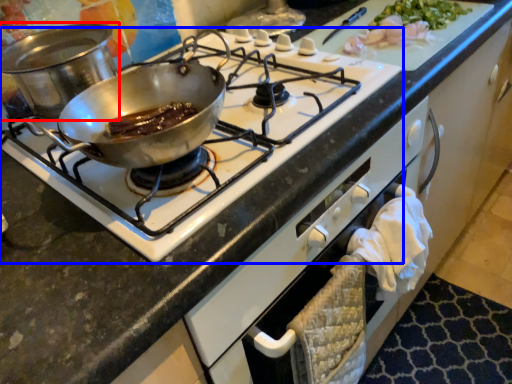
Question: Which point is further to the camera, kitchen appliance (highlighted by a red box) or gas stove (highlighted by a blue box)?

Choices:
 (A) kitchen appliance
 (B) gas stove

Answer: (A)